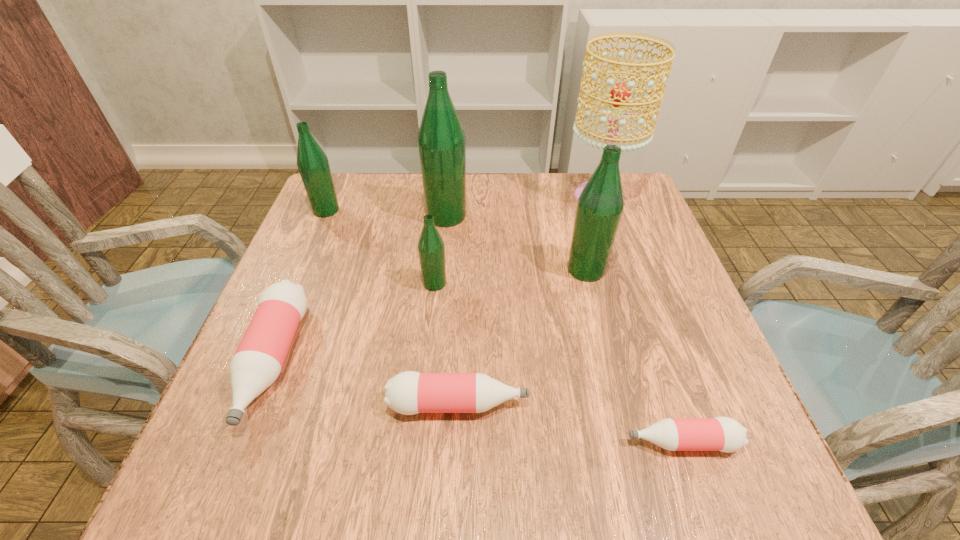
Where is `vacant space at the near edge of the desktop`? This screenshot has height=540, width=960. vacant space at the near edge of the desktop is located at coordinates (397, 474).

I want to click on free space at the left edge of the desktop, so click(274, 426).

Identify the location of vacant space at the right edge. (656, 279).

This screenshot has width=960, height=540. Identify the location of free region at the far left corner of the desktop. click(x=370, y=185).

Where is `vacant area at the far right corner`? The height and width of the screenshot is (540, 960). vacant area at the far right corner is located at coordinates (634, 212).

Find the location of a particular element. empty space that is in between the second smallest green bottle and the second biggest green bottle is located at coordinates (456, 240).

Locate an element on the screen. Image resolution: width=960 pixels, height=540 pixels. unoccupied position between the shortest bottle and the second pink bottle from right to left is located at coordinates (570, 423).

The height and width of the screenshot is (540, 960). Identify the location of vacant space in between the fourth tallest bottle and the fourth tallest object. (380, 247).

You are a GUI agent. You are given a task and a screenshot of the screen. Output one action in this format:
    pyautogui.click(x=<x>, y=<y>)
    Task: Click on the free point between the sixth tallest bottle and the shortest object
    Image resolution: width=960 pixels, height=540 pixels.
    Given the screenshot: What is the action you would take?
    pyautogui.click(x=570, y=423)

In order to click on free space between the third tallest object and the tallest bottle in this screenshot , I will do `click(516, 243)`.